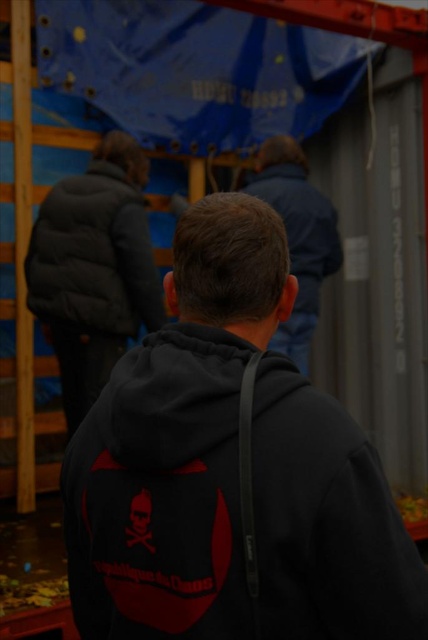
In the scene shown: Does black matte hoodie at center come in front of dark blue jacket at center?

Yes, black matte hoodie at center is in front of dark blue jacket at center.

Identify the location of black matte hoodie at center. [x=231, y=470].

Is point (318, 426) farther from camera compared to point (303, 260)?

No, (318, 426) is closer to viewer.

The height and width of the screenshot is (640, 428). In order to click on black matte hoodie at center in this screenshot , I will do (x=231, y=470).

Can you confirm if dark gray puffy jacket at upper left is thinner than dark blue jacket at center?

No.

Is dark gray puffy jacket at upper left smaller than dark blue jacket at center?

Correct, dark gray puffy jacket at upper left occupies less space than dark blue jacket at center.

Is point (133, 236) behind point (303, 259)?

No, (133, 236) is in front of (303, 259).

Identify the location of dark gray puffy jacket at upper left. The image size is (428, 640). (94, 257).

Who is shorter, black matte hoodie at center or dark gray puffy jacket at upper left?

dark gray puffy jacket at upper left is shorter.

Describe the element at coordinates (231, 470) in the screenshot. I see `black matte hoodie at center` at that location.

Describe the element at coordinates (231, 470) in the screenshot. I see `black matte hoodie at center` at that location.

Locate an element on the screen. This screenshot has width=428, height=640. black matte hoodie at center is located at coordinates (231, 470).